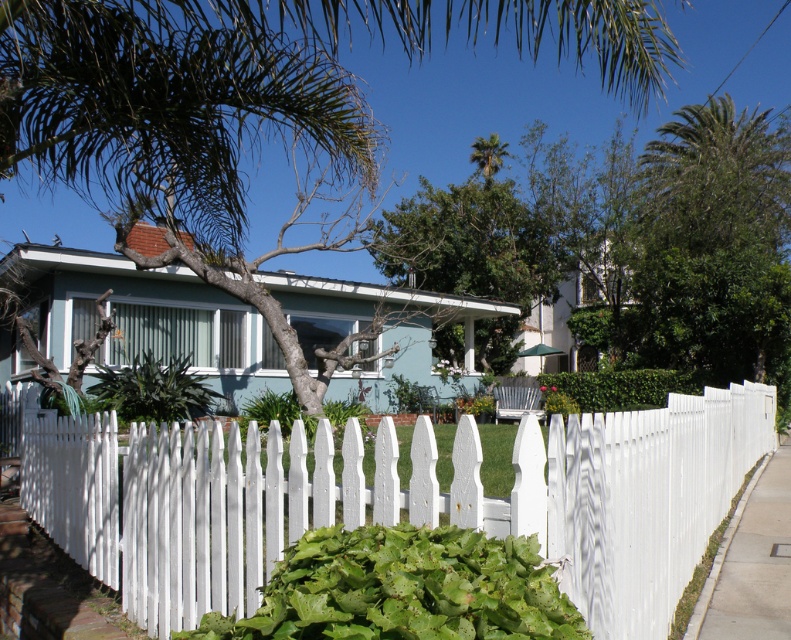
You are standing on the smooth concrete sidewalk at lower right and want to walk to the house. Which direction should you go to avoid the white picket fence at center?

The white picket fence at center is positioned over the smooth concrete sidewalk at lower right, so to avoid it, you should walk towards the house while staying on the sidewalk, moving around the fence.

You are a drone operator who needs to fly a drone from the white picket fence at center to the green leafy palm tree at upper center. What is the approximate distance you need to cover?

The distance between the white picket fence at center and the green leafy palm tree at upper center is approximately 22 meters.